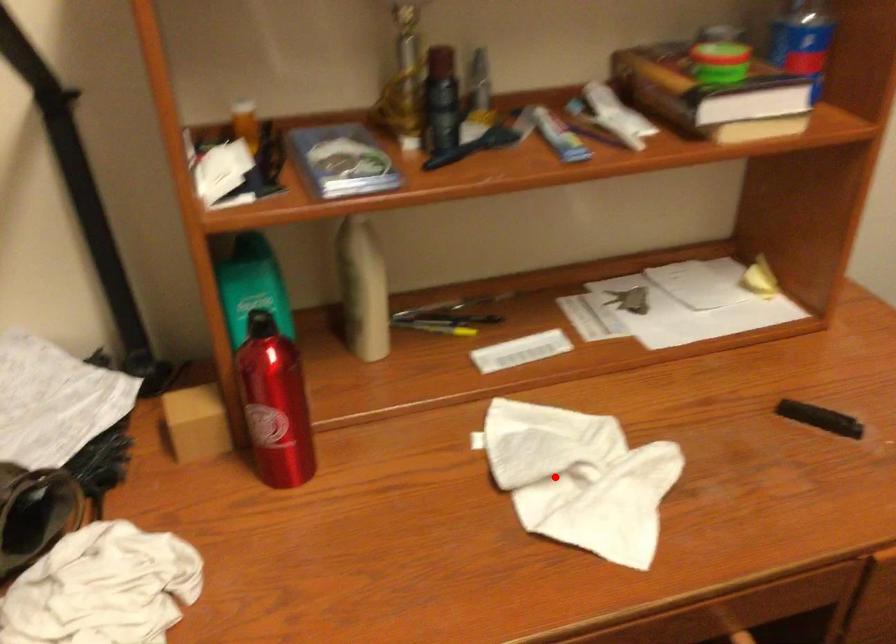
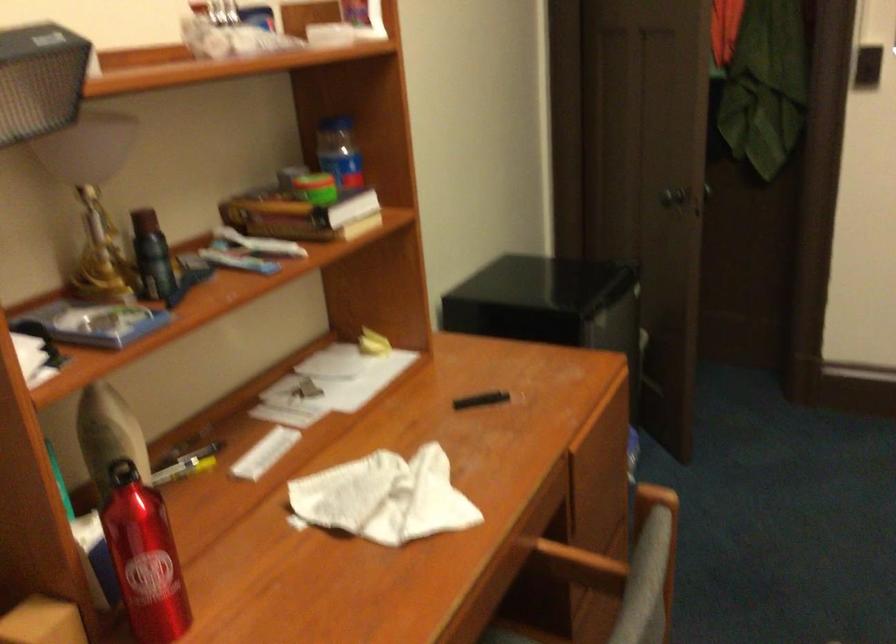
Locate, in the second image, the point that corresponds to the highlighted location in the first image.

(383, 498)